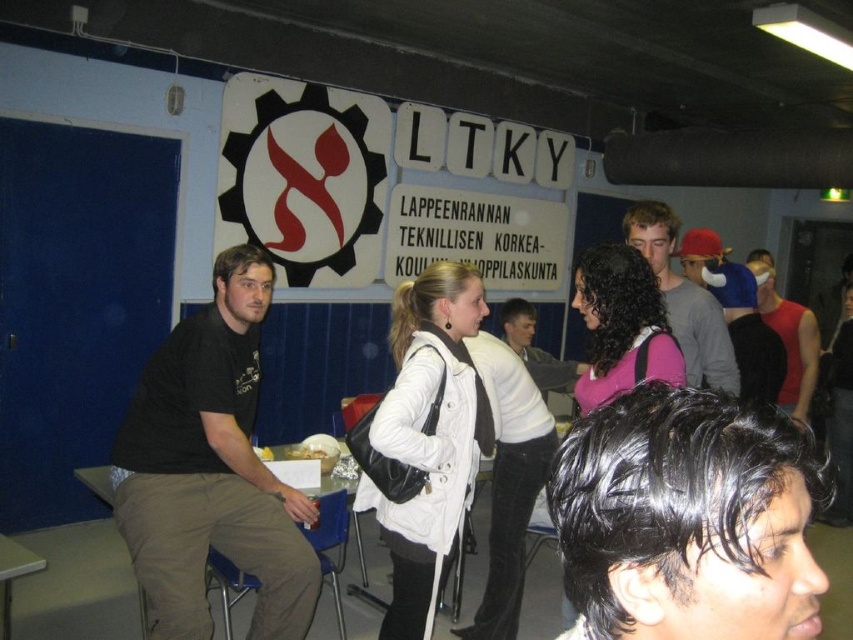
Question: Is white matte jacket at center thinner than yellow matte food at center?

Choices:
 (A) no
 (B) yes

Answer: (A)

Question: Can you confirm if black hair at center is positioned to the right of light brown leather jacket at center?

Choices:
 (A) no
 (B) yes

Answer: (A)

Question: Which point is closer to the camera taking this photo?

Choices:
 (A) (766, 627)
 (B) (810, 362)
 (C) (675, 218)

Answer: (A)

Question: Can you confirm if blue denim jacket at center is smaller than red sleeveless shirt at right?

Choices:
 (A) no
 (B) yes

Answer: (B)

Question: Which of the following is the closest to the observer?

Choices:
 (A) black matte shirt at left
 (B) black hair at center
 (C) blue denim jacket at center
 (D) light brown leather jacket at center

Answer: (B)

Question: Based on their relative distances, which object is farther from the black matte shirt at left?

Choices:
 (A) light brown leather jacket at center
 (B) white matte jacket at center
 (C) black hair at center
 (D) blue denim jacket at center

Answer: (D)